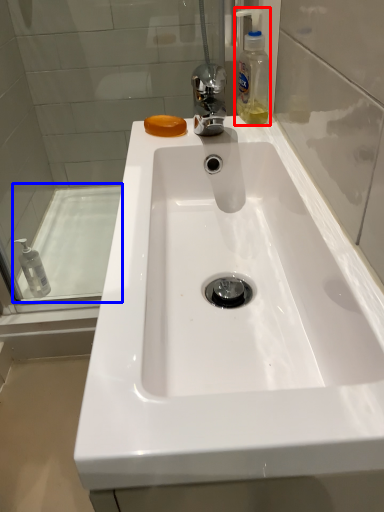
Question: Among these objects, which one is nearest to the camera, soap dispenser (highlighted by a red box) or bath (highlighted by a blue box)?

Choices:
 (A) soap dispenser
 (B) bath

Answer: (A)